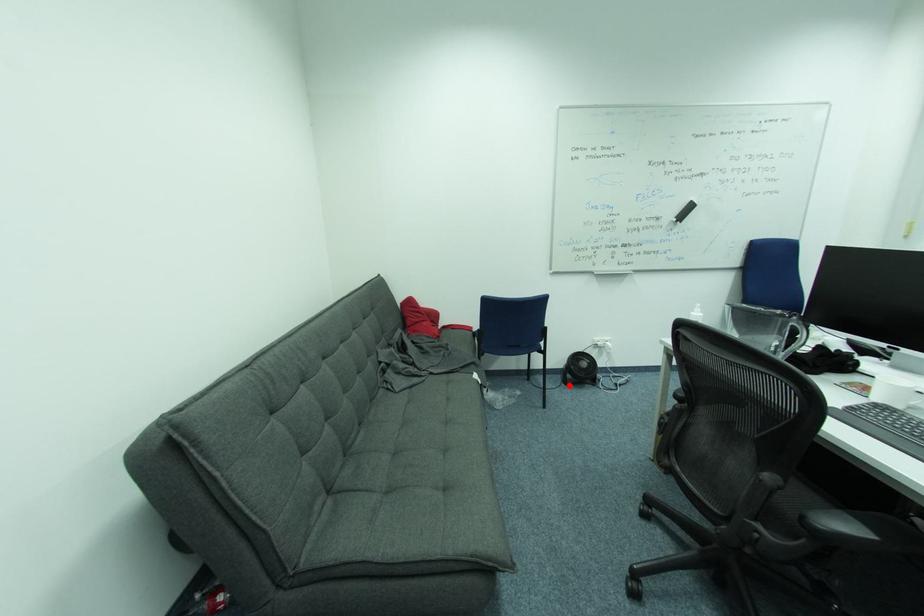
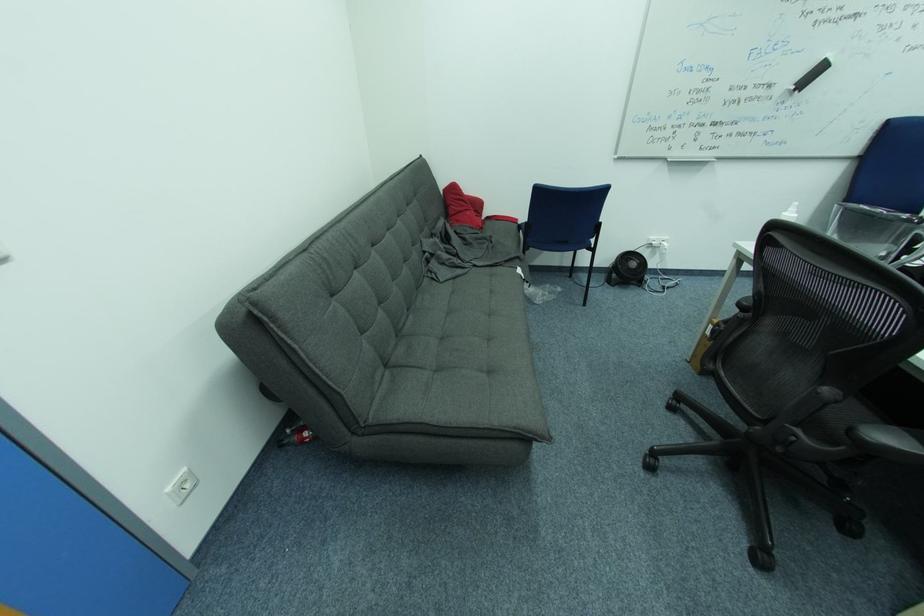
Question: I am providing you with two images of the same scene from different viewpoints. In image1, a red point is highlighted. Considering the same 3D point in image2, which of the following is correct?

Choices:
 (A) It is closer
 (B) It is farther

Answer: (A)